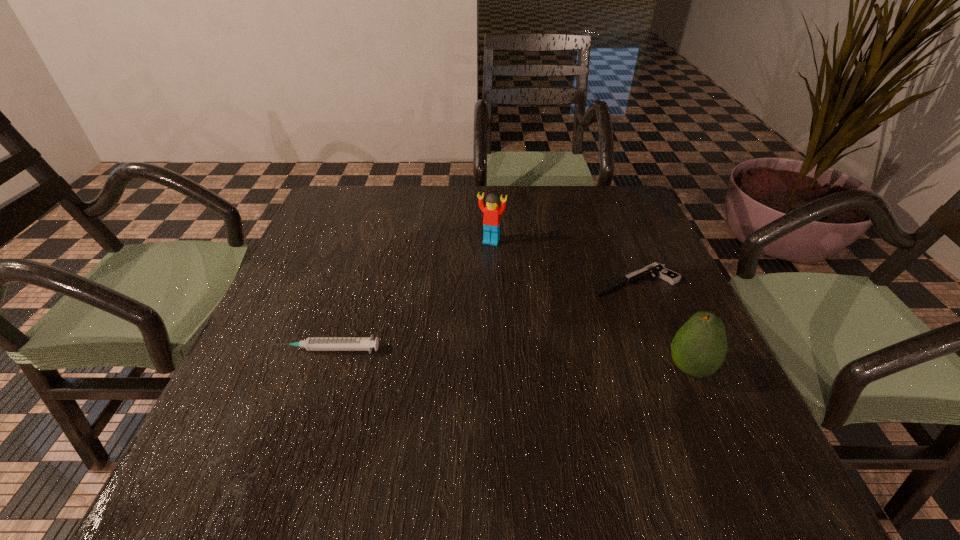
The width and height of the screenshot is (960, 540). In order to click on free space on the desktop that is between the third tallest object and the avocado and is positioned on the face of the farthest object in this screenshot , I will do `click(450, 356)`.

Find the location of a particular element. The image size is (960, 540). free spot on the desktop that is between the leftmost object and the avocado and is positioned on the front-facing side of the second farthest object is located at coordinates (468, 357).